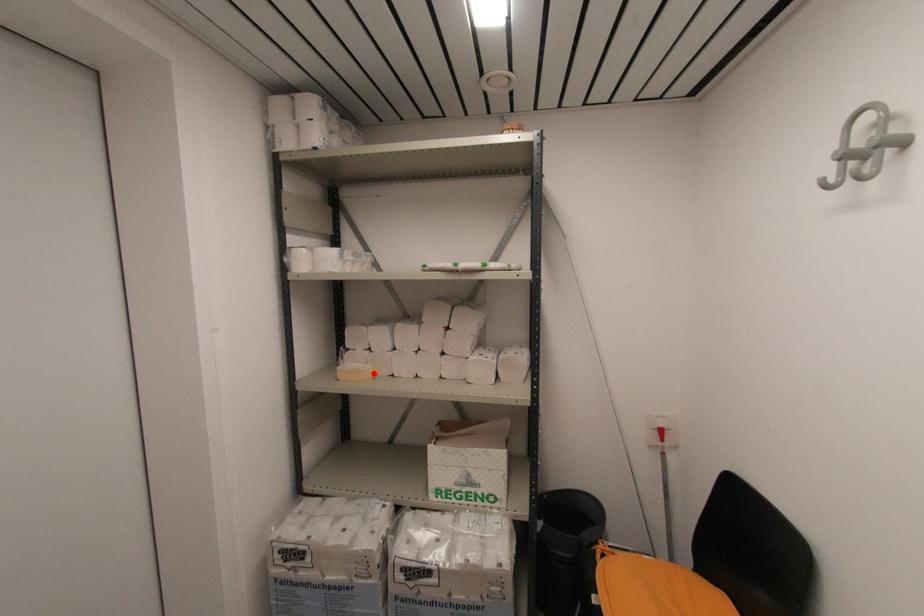
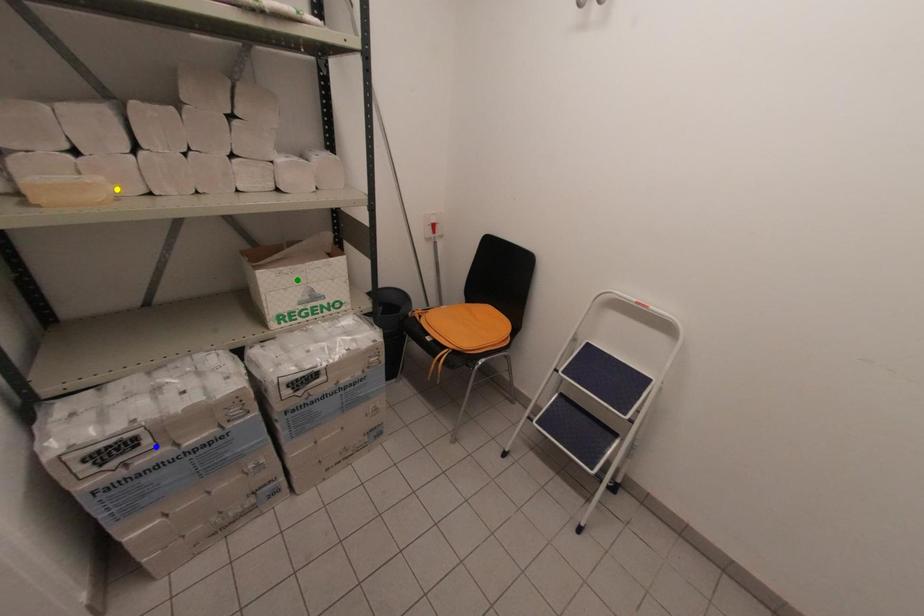
Question: I am providing you with two images of the same scene from different viewpoints. A red point is marked on the first image. You are given multiple points on the second image. In image 2, which mark is for the same physical point as the one in image 1?

Choices:
 (A) blue point
 (B) yellow point
 (C) green point

Answer: (B)